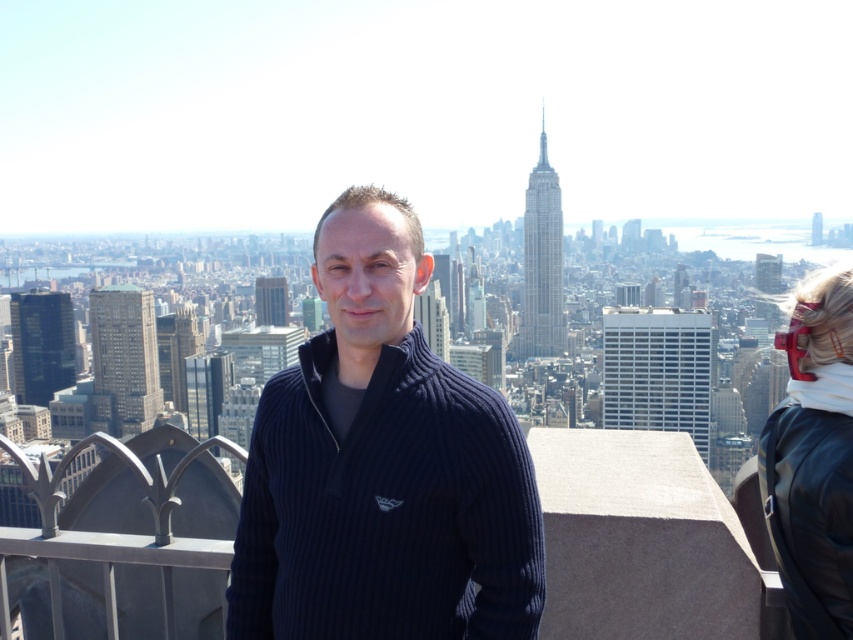
Question: Can you confirm if dark blue ribbed sweater at center is wider than white fleece at right?

Choices:
 (A) yes
 (B) no

Answer: (A)

Question: Is dark blue ribbed sweater at center to the left of white fleece at right from the viewer's perspective?

Choices:
 (A) yes
 (B) no

Answer: (A)

Question: Which point is closer to the camera?

Choices:
 (A) (831, 483)
 (B) (302, 442)

Answer: (A)

Question: Which object appears farthest from the camera in this image?

Choices:
 (A) white fleece at right
 (B) dark blue ribbed sweater at center

Answer: (B)

Question: Can you confirm if dark blue ribbed sweater at center is positioned to the right of white fleece at right?

Choices:
 (A) yes
 (B) no

Answer: (B)

Question: Which object appears closest to the camera in this image?

Choices:
 (A) white fleece at right
 (B) dark blue ribbed sweater at center

Answer: (A)